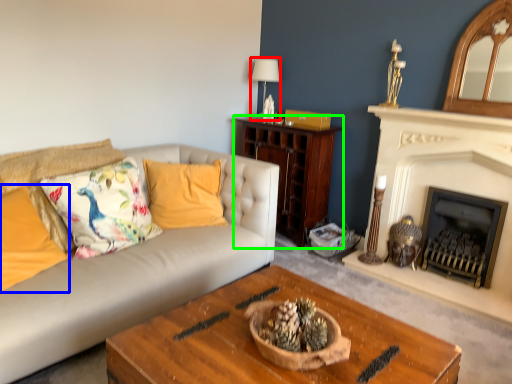
Question: Which is farther away from lamp (highlighted by a red box)? pillow (highlighted by a blue box) or cabinetry (highlighted by a green box)?

Choices:
 (A) pillow
 (B) cabinetry

Answer: (A)